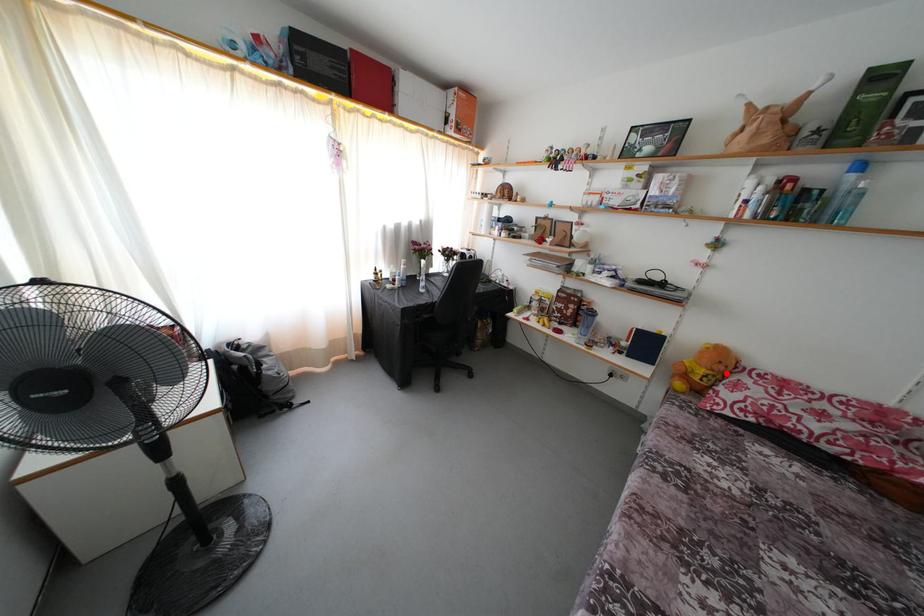
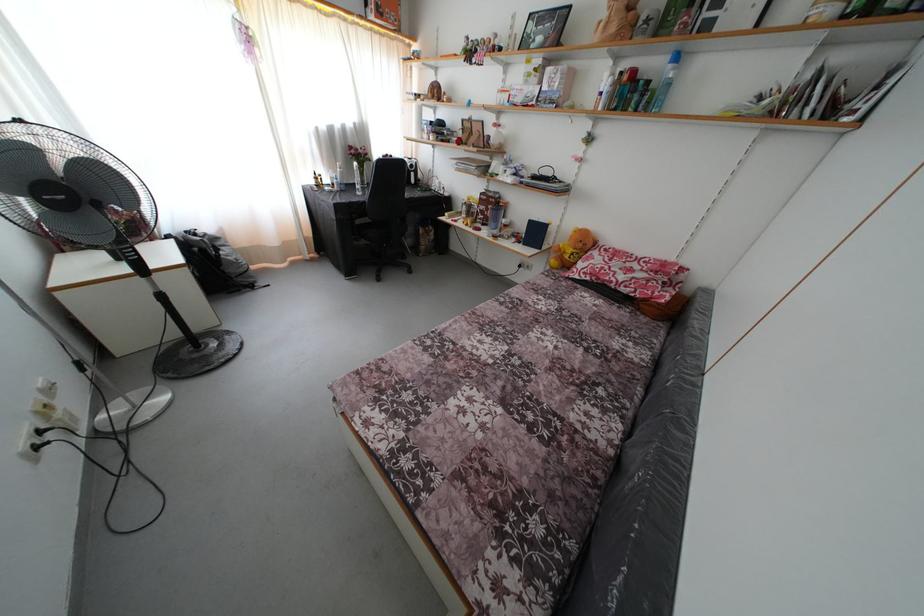
In the second image, find the point that corresponds to the highlighted location in the first image.

(585, 251)